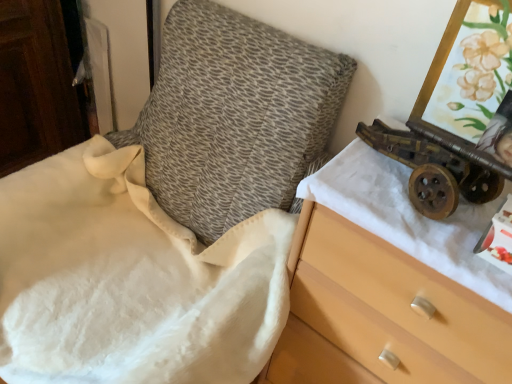
What do you see at coordinates (439, 147) in the screenshot?
I see `rusty metal cannon at right` at bounding box center [439, 147].

In order to face rusty metal cannon at right, should I rotate leftwards or rightwards?

Rotate right and turn 21.825 degrees.

The image size is (512, 384). In order to click on wooden chest of drawers at right in this screenshot , I will do pos(391,284).

Locate an element on the screen. rusty metal cannon at right is located at coordinates (439, 147).

Is point (434, 259) closer to viewer compared to point (481, 91)?

Yes.

Is wooden chest of drawers at right looking in the opposite direction of rusty metal cannon at right?

wooden chest of drawers at right does not have its back to rusty metal cannon at right.

Is the depth of wooden chest of drawers at right greater than that of rusty metal cannon at right?

No, the depth of wooden chest of drawers at right is less than that of rusty metal cannon at right.

Is wooden chest of drawers at right positioned far away from rusty metal cannon at right?

Actually, wooden chest of drawers at right and rusty metal cannon at right are a little close together.

Which is in front, point (415, 108) or point (216, 379)?

Point (216, 379)

Could wooden drawer at right be considered to be inside rusty metal cannon at right?

No, rusty metal cannon at right does not contain wooden drawer at right.

Who is bigger, rusty metal cannon at right or wooden drawer at right?

wooden drawer at right.

From the image's perspective, is rusty metal cannon at right above wooden drawer at right?

Indeed, from the image's perspective, rusty metal cannon at right is shown above wooden drawer at right.

Is wooden drawer at right looking in the opposite direction of wooden chest of drawers at right?

wooden drawer at right does not have its back to wooden chest of drawers at right.

Is wooden drawer at right at the left side of wooden chest of drawers at right?

Indeed, wooden drawer at right is positioned on the left side of wooden chest of drawers at right.

Locate an element on the screen. The width and height of the screenshot is (512, 384). the chest of drawers below the wooden drawer at right (from the image's perspective) is located at coordinates (391, 284).

Does point (13, 221) lie in front of point (423, 265)?

No.

Is rusty metal cannon at right shorter than wooden chest of drawers at right?

Yes, rusty metal cannon at right is shorter than wooden chest of drawers at right.

From the image's perspective, between rusty metal cannon at right and wooden chest of drawers at right, which one is located above?

rusty metal cannon at right, from the image's perspective.

Visually, is rusty metal cannon at right positioned to the left or to the right of wooden chest of drawers at right?

In the image, rusty metal cannon at right appears on the left side of wooden chest of drawers at right.

Is rusty metal cannon at right surrounding wooden chest of drawers at right?

That's incorrect, wooden chest of drawers at right is not inside rusty metal cannon at right.

Is wooden chest of drawers at right oriented towards wooden drawer at right?

No, wooden chest of drawers at right is not oriented towards wooden drawer at right.

Would you say wooden chest of drawers at right is to the left or to the right of wooden drawer at right in the picture?

Clearly, wooden chest of drawers at right is on the right of wooden drawer at right in the image.

Which is correct: wooden chest of drawers at right is inside wooden drawer at right, or outside of it?

wooden chest of drawers at right is not inside wooden drawer at right, it's outside.

What's the angular difference between wooden drawer at right and rusty metal cannon at right's facing directions?

wooden drawer at right and rusty metal cannon at right are facing 0.0492 degrees away from each other.

Is wooden drawer at right facing away from rusty metal cannon at right?

No, wooden drawer at right is not facing the opposite direction of rusty metal cannon at right.

Who is more distant, wooden drawer at right or rusty metal cannon at right?

rusty metal cannon at right is behind.

Does point (189, 380) appear closer or farther from the camera than point (419, 126)?

Point (189, 380) is positioned farther from the camera compared to point (419, 126).

Image resolution: width=512 pixels, height=384 pixels. I want to click on chest of drawers that is on the right side of rusty metal cannon at right, so click(x=391, y=284).

Find the location of a particular element. The image size is (512, 384). furniture located on the left of rusty metal cannon at right is located at coordinates (169, 216).

Estimate the real-world distances between objects in this image. Which object is further from rusty metal cannon at right, wooden drawer at right or wooden chest of drawers at right?

Based on the image, wooden drawer at right appears to be further to rusty metal cannon at right.

Considering their positions, is rusty metal cannon at right positioned closer to wooden chest of drawers at right than wooden drawer at right?

Based on the image, rusty metal cannon at right appears to be nearer to wooden chest of drawers at right.

From the image, which object appears to be farther from wooden drawer at right, rusty metal cannon at right or wooden chest of drawers at right?

Among the two, rusty metal cannon at right is located further to wooden drawer at right.

Looking at the image, which one is located closer to wooden chest of drawers at right, wooden drawer at right or rusty metal cannon at right?

rusty metal cannon at right is positioned closer to the anchor wooden chest of drawers at right.

Looking at the image, which one is located closer to wooden drawer at right, wooden chest of drawers at right or rusty metal cannon at right?

The object closer to wooden drawer at right is wooden chest of drawers at right.

Looking at the image, which one is located further to rusty metal cannon at right, wooden chest of drawers at right or wooden drawer at right?

Among the two, wooden drawer at right is located further to rusty metal cannon at right.

Locate an element on the screen. The image size is (512, 384). toy situated between wooden drawer at right and wooden chest of drawers at right from left to right is located at coordinates (439, 147).